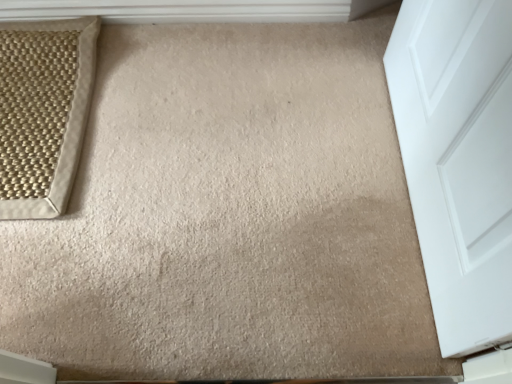
The image size is (512, 384). I want to click on unoccupied region to the right of beige woven rug at upper left, so (189, 113).